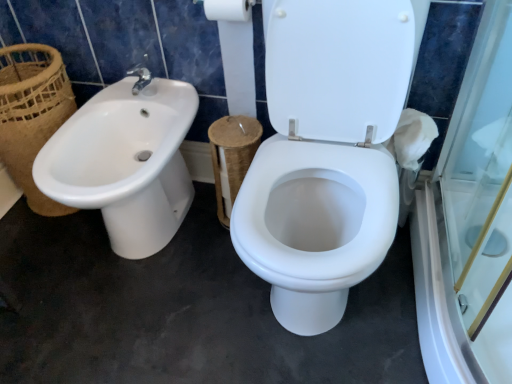
Find the location of a particular element. The height and width of the screenshot is (384, 512). vacant area in front of white glossy sink at left is located at coordinates (130, 325).